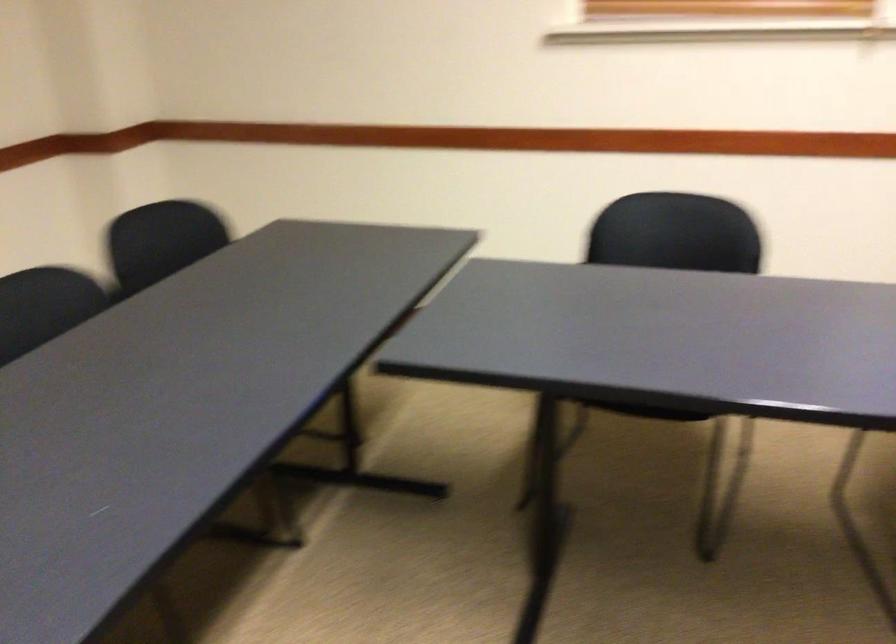
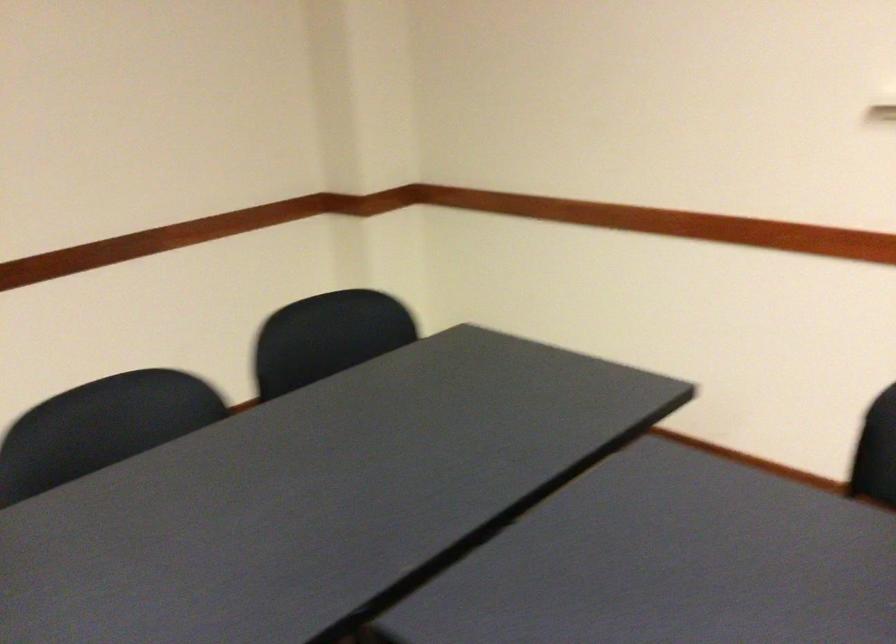
Question: The camera is either moving clockwise (left) or counter-clockwise (right) around the object. The first image is from the beginning of the video and the second image is from the end. Is the camera moving left or right when shooting the video?

Choices:
 (A) Left
 (B) Right

Answer: (B)